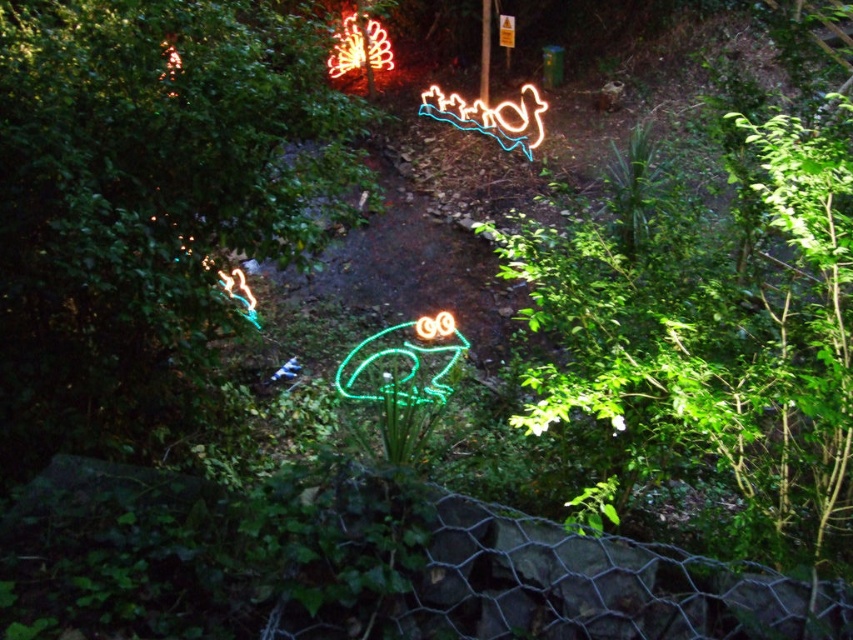
Is point (440, 364) positioned after point (358, 49)?

No.

Does point (387, 326) come closer to viewer compared to point (386, 33)?

Yes, it is.

Where is `neon green frog at center`? neon green frog at center is located at coordinates (399, 365).